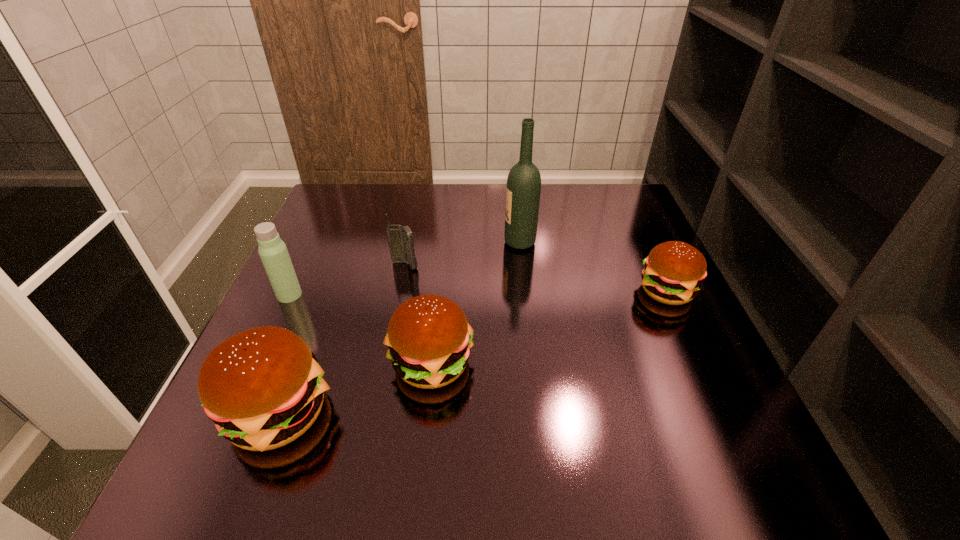
This screenshot has height=540, width=960. In the image, there is a desktop. What are the coordinates of `free region at the far edge` in the screenshot? It's located at (408, 187).

Identify the location of free space at the near edge of the desktop. (396, 389).

This screenshot has width=960, height=540. I want to click on blank space at the left edge of the desktop, so click(x=302, y=247).

The image size is (960, 540). I want to click on vacant space at the right edge, so click(x=700, y=387).

The height and width of the screenshot is (540, 960). In order to click on free space at the far left corner of the desktop in this screenshot , I will do pyautogui.click(x=326, y=199).

At what (x,y) coordinates should I click in order to perform the action: click on vacant space that's between the second shortest hamburger and the shortest hamburger. Please return your answer as a coordinate pair (x, y). The height and width of the screenshot is (540, 960). Looking at the image, I should click on (549, 327).

Where is `free area in between the thermos bottle and the farthest hamburger`? free area in between the thermos bottle and the farthest hamburger is located at coordinates (478, 293).

Locate an element on the screen. free space between the rightmost hamburger and the cellular telephone is located at coordinates (536, 278).

Where is `unoccupied area between the cellular telephone and the wine bottle`? Image resolution: width=960 pixels, height=540 pixels. unoccupied area between the cellular telephone and the wine bottle is located at coordinates tap(463, 254).

What are the coordinates of `free space between the second object from right to left and the thermos bottle` in the screenshot? It's located at (404, 268).